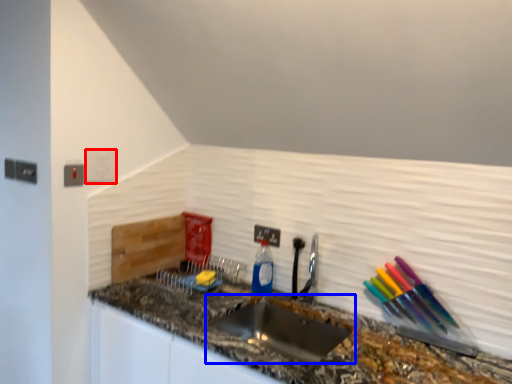
Question: Among these objects, which one is nearest to the camera, light switch (highlighted by a red box) or sink (highlighted by a blue box)?

Choices:
 (A) light switch
 (B) sink

Answer: (B)